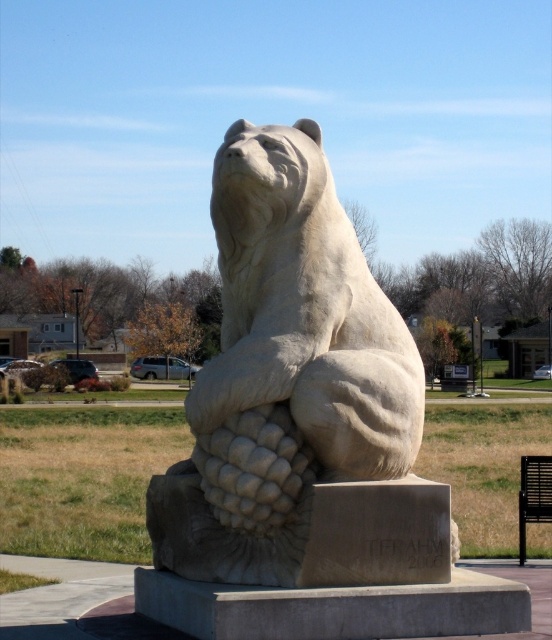
Question: Which object appears farthest from the camera in this image?

Choices:
 (A) white stone bear at center
 (B) black metal park bench at lower right

Answer: (B)

Question: Which of the following is the closest to the observer?

Choices:
 (A) (549, 516)
 (B) (379, 426)

Answer: (B)

Question: From the image, what is the correct spatial relationship of white stone bear at center in relation to black metal park bench at lower right?

Choices:
 (A) left
 (B) right

Answer: (A)

Question: Is white stone bear at center to the left of black metal park bench at lower right from the viewer's perspective?

Choices:
 (A) yes
 (B) no

Answer: (A)

Question: Does white stone bear at center appear under black metal park bench at lower right?

Choices:
 (A) yes
 (B) no

Answer: (B)